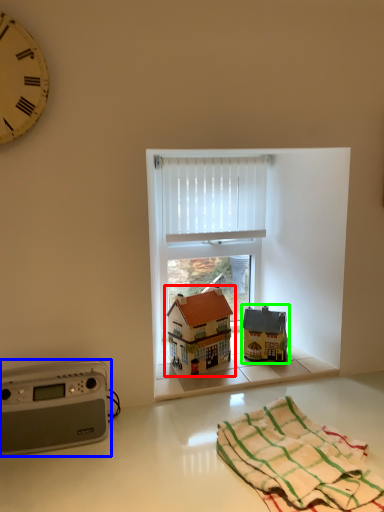
Question: Which object is the closest to the toy (highlighted by a red box)? Choose among these: stereo (highlighted by a blue box) or toy (highlighted by a green box).

Choices:
 (A) stereo
 (B) toy

Answer: (B)